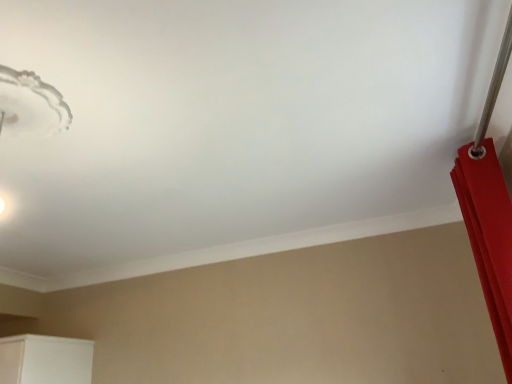
Question: Considering the positions of matte red curtain at right and white frosted glass lampshade at upper left in the image, is matte red curtain at right bigger or smaller than white frosted glass lampshade at upper left?

Choices:
 (A) small
 (B) big

Answer: (B)

Question: Considering the positions of point (493, 296) and point (10, 71), is point (493, 296) closer or farther from the camera than point (10, 71)?

Choices:
 (A) closer
 (B) farther

Answer: (B)

Question: Considering their positions, is matte red curtain at right located in front of or behind white frosted glass lampshade at upper left?

Choices:
 (A) front
 (B) behind

Answer: (B)

Question: Is white frosted glass lampshade at upper left wider or thinner than matte red curtain at right?

Choices:
 (A) thin
 (B) wide

Answer: (B)

Question: In the image, is white frosted glass lampshade at upper left on the left side or the right side of matte red curtain at right?

Choices:
 (A) left
 (B) right

Answer: (A)

Question: From a real-world perspective, is white frosted glass lampshade at upper left positioned above or below matte red curtain at right?

Choices:
 (A) below
 (B) above

Answer: (B)

Question: From the image's perspective, is white frosted glass lampshade at upper left positioned above or below matte red curtain at right?

Choices:
 (A) below
 (B) above

Answer: (B)